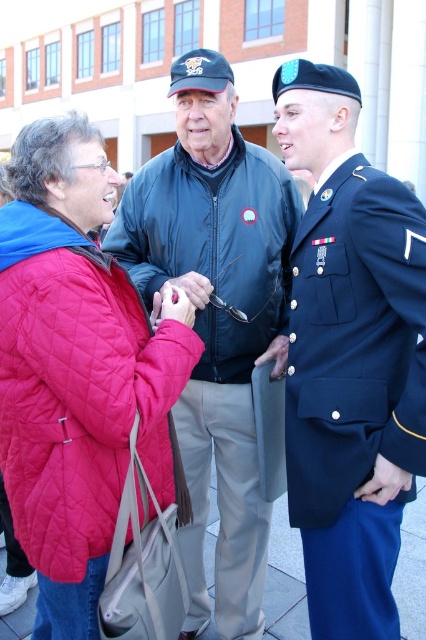
You are a photographer setting up a photo shoot for a clothing brand. You have two models wearing the navy blue fabric uniform at right and the quilted red jacket at left. Based on the scene description, which model should you place closer to the camera to ensure their clothing details are more prominent in the photo?

You should place the quilted red jacket at left closer to the camera because its width is greater than the navy blue fabric uniform at right, making its details more prominent when closer.

You are a photographer trying to capture a candid shot of the man in the dark blue zip up jacket with a small emblem on the chest. You want to ensure that your camera lens is focused on his face. Which of the two points, point 1 at (259, 259) or point 2 at (414, 252), should you aim the focus point at to ensure his face is in sharp focus?

Point 1 at (259, 259) is further to the camera than point 2 at (414, 252). Therefore, to focus on the man in the dark blue zip up jacket with a small emblem on the chest, you should aim the focus point at point 1 at (259, 259) since it is closer to the camera and likely where his face is positioned.